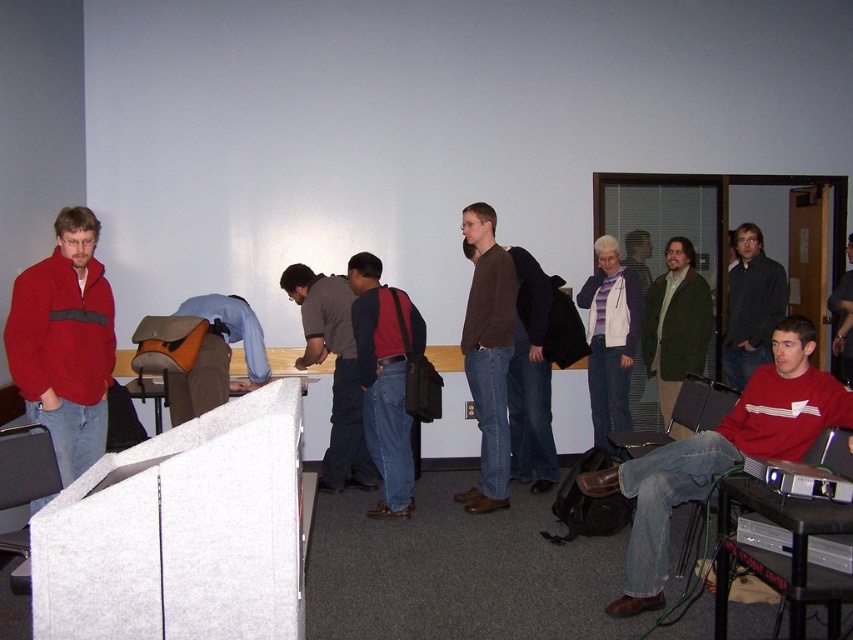
You are organizing a photo shoot and need to arrange two models wearing the white fleece jacket at center and the dark gray sweater at center. Based on the scene description, which clothing item should be placed higher in the frame to maintain visual balance?

The white fleece jacket at center should be placed higher in the frame since it has a greater height compared to the dark gray sweater at center, helping to balance the composition by compensating for its larger size.

You are standing in the room and want to hand a document to the person wearing the denim jacket at left. Since the white fleece jacket at center is in the way, can you easily reach them?

The denim jacket at left is behind the white fleece jacket at center, so you cannot easily reach them without moving the white fleece jacket at center out of the way.